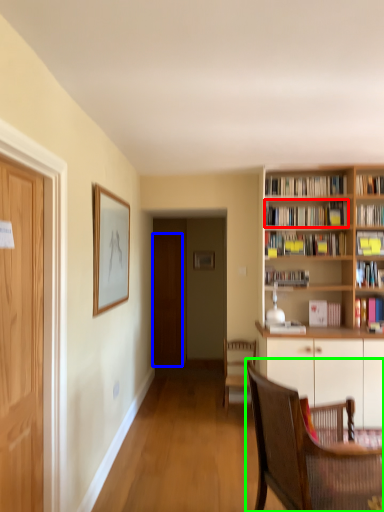
Question: Which object is the farthest from book (highlighted by a red box)? Choose among these: door (highlighted by a blue box) or chair (highlighted by a green box).

Choices:
 (A) door
 (B) chair

Answer: (A)